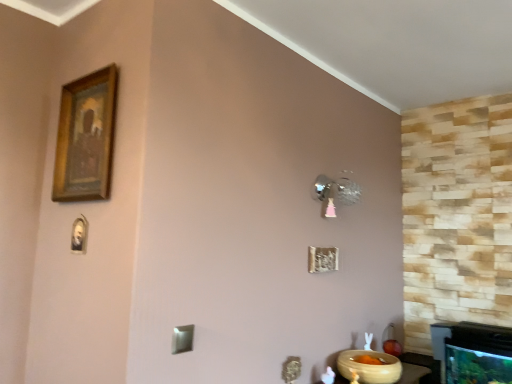
I want to click on beige glossy bowl at lower right, so click(x=370, y=367).

The width and height of the screenshot is (512, 384). Describe the element at coordinates (370, 367) in the screenshot. I see `beige glossy bowl at lower right` at that location.

Identify the location of gold wooden picture frame at upper left. (85, 137).

What do you see at coordinates (85, 137) in the screenshot? This screenshot has width=512, height=384. I see `gold wooden picture frame at upper left` at bounding box center [85, 137].

Where is `beige glossy bowl at lower right`? beige glossy bowl at lower right is located at coordinates (370, 367).

Is gold wooden picture frame at upper left to the right of beige glossy bowl at lower right from the viewer's perspective?

Incorrect, gold wooden picture frame at upper left is not on the right side of beige glossy bowl at lower right.

Is gold wooden picture frame at upper left further to camera compared to beige glossy bowl at lower right?

No.

Which point is more distant from viewer, (x=86, y=140) or (x=400, y=364)?

The point (x=400, y=364) is more distant.

From the image's perspective, relative to beige glossy bowl at lower right, is gold wooden picture frame at upper left above or below?

Clearly, from the image's perspective, gold wooden picture frame at upper left is above beige glossy bowl at lower right.

From a real-world perspective, is gold wooden picture frame at upper left physically below beige glossy bowl at lower right?

Incorrect, from a real-world perspective, gold wooden picture frame at upper left is higher than beige glossy bowl at lower right.

Considering the sizes of objects gold wooden picture frame at upper left and beige glossy bowl at lower right in the image provided, who is wider, gold wooden picture frame at upper left or beige glossy bowl at lower right?

Wider between the two is beige glossy bowl at lower right.

From the picture: Who is shorter, gold wooden picture frame at upper left or beige glossy bowl at lower right?

Standing shorter between the two is beige glossy bowl at lower right.

Between gold wooden picture frame at upper left and beige glossy bowl at lower right, which one has larger size?

With larger size is beige glossy bowl at lower right.

Based on the photo, is beige glossy bowl at lower right a part of gold wooden picture frame at upper left?

No, beige glossy bowl at lower right is not surrounded by gold wooden picture frame at upper left.

Is gold wooden picture frame at upper left far from beige glossy bowl at lower right?

Indeed, gold wooden picture frame at upper left is not near beige glossy bowl at lower right.

Does gold wooden picture frame at upper left turn towards beige glossy bowl at lower right?

No, gold wooden picture frame at upper left is not turned towards beige glossy bowl at lower right.

Can you tell me how much gold wooden picture frame at upper left and beige glossy bowl at lower right differ in facing direction?

There is a 89.4-degree angle between the facing directions of gold wooden picture frame at upper left and beige glossy bowl at lower right.

Locate an element on the screen. glass bowl behind the gold wooden picture frame at upper left is located at coordinates (370, 367).

Considering the relative positions of beige glossy bowl at lower right and gold wooden picture frame at upper left in the image provided, is beige glossy bowl at lower right to the right of gold wooden picture frame at upper left from the viewer's perspective?

Yes, beige glossy bowl at lower right is to the right of gold wooden picture frame at upper left.

Does beige glossy bowl at lower right lie behind gold wooden picture frame at upper left?

Yes, the depth of beige glossy bowl at lower right is greater than that of gold wooden picture frame at upper left.

Which is farther, (362,381) or (63,174)?

Positioned behind is point (362,381).

From the image's perspective, between beige glossy bowl at lower right and gold wooden picture frame at upper left, who is located below?

From the image's view, beige glossy bowl at lower right is below.

Consider the image. From a real-world perspective, which object stands above the other?

→ gold wooden picture frame at upper left.

Considering the sizes of objects beige glossy bowl at lower right and gold wooden picture frame at upper left in the image provided, who is wider, beige glossy bowl at lower right or gold wooden picture frame at upper left?

With larger width is beige glossy bowl at lower right.

In terms of height, does beige glossy bowl at lower right look taller or shorter compared to gold wooden picture frame at upper left?

In the image, beige glossy bowl at lower right appears to be shorter than gold wooden picture frame at upper left.

Can you confirm if beige glossy bowl at lower right is smaller than gold wooden picture frame at upper left?

No, beige glossy bowl at lower right is not smaller than gold wooden picture frame at upper left.

Is gold wooden picture frame at upper left completely or partially inside beige glossy bowl at lower right?

No, beige glossy bowl at lower right does not contain gold wooden picture frame at upper left.

Is there a large distance between beige glossy bowl at lower right and gold wooden picture frame at upper left?

Indeed, beige glossy bowl at lower right is not near gold wooden picture frame at upper left.

Is beige glossy bowl at lower right aimed at gold wooden picture frame at upper left?

No, beige glossy bowl at lower right does not turn towards gold wooden picture frame at upper left.

How different are the orientations of beige glossy bowl at lower right and gold wooden picture frame at upper left in degrees?

They differ by 89.4 degrees in their facing directions.

I want to click on picture frame above the beige glossy bowl at lower right (from the image's perspective), so click(85, 137).

I want to click on glass bowl beneath the gold wooden picture frame at upper left (from a real-world perspective), so click(370, 367).

Find the location of a particular element. The width and height of the screenshot is (512, 384). picture frame on the left of beige glossy bowl at lower right is located at coordinates (85, 137).